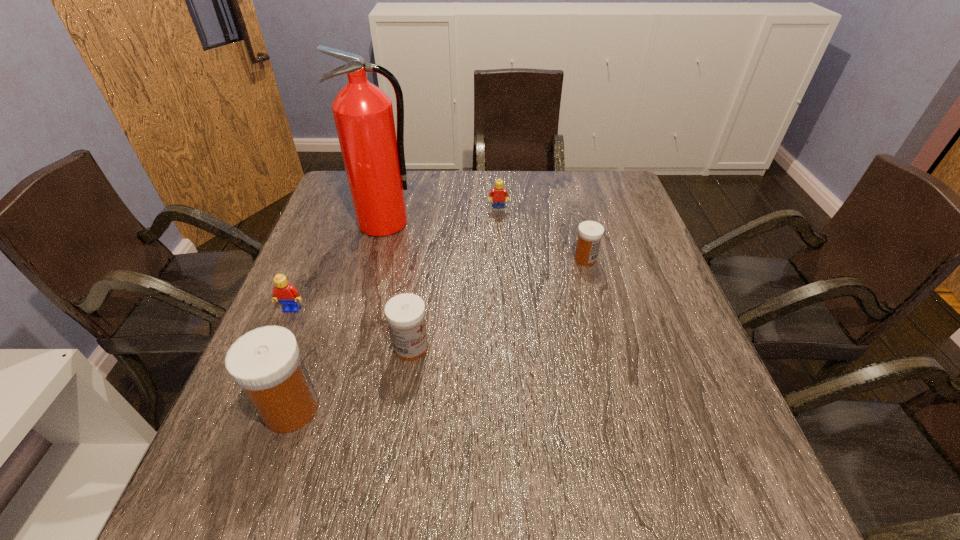
Locate an element on the screen. The height and width of the screenshot is (540, 960). vacant position for inserting another medicine evenly is located at coordinates (507, 299).